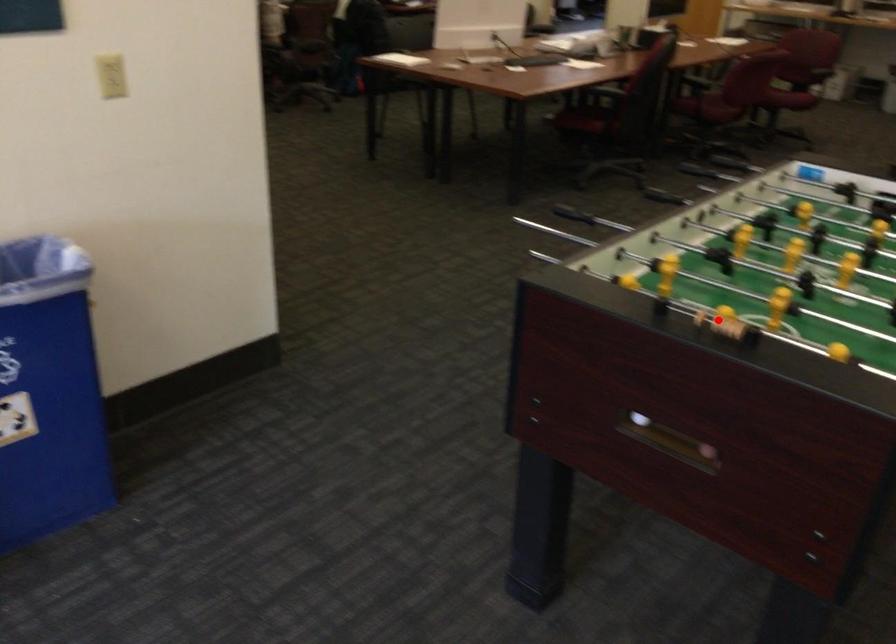
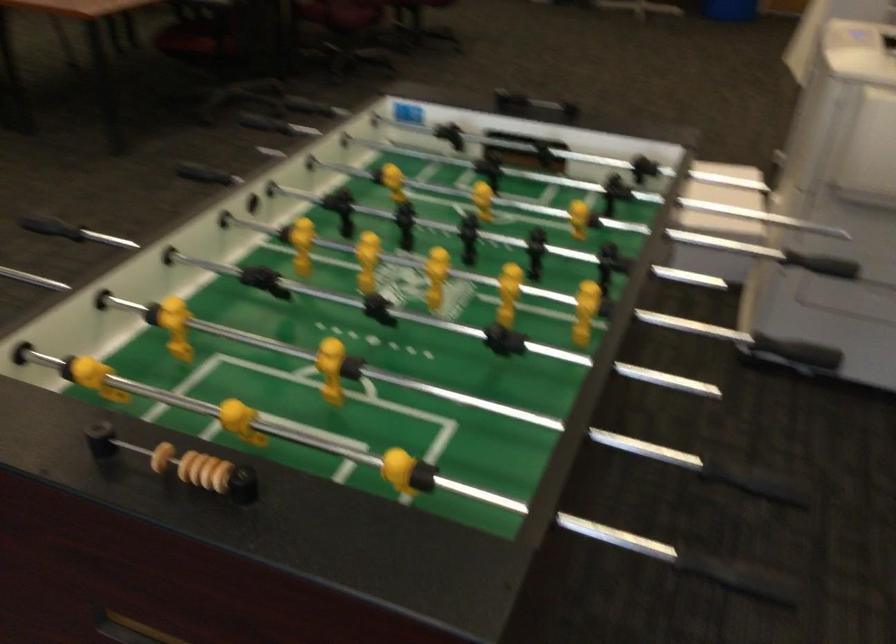
In the second image, find the point that corresponds to the highlighted location in the first image.

(186, 465)